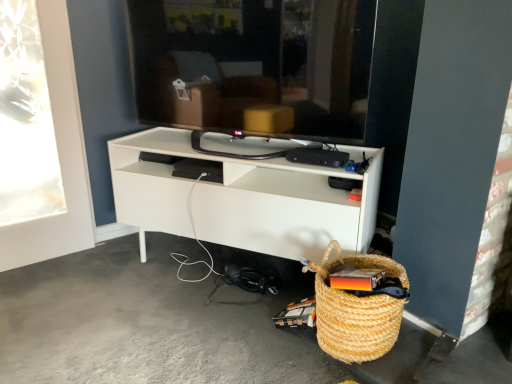
At what (x,y) coordinates should I click in order to perform the action: click on free space in front of white matte shelf at center. Please return your answer as a coordinate pair (x, y). Looking at the image, I should click on (202, 334).